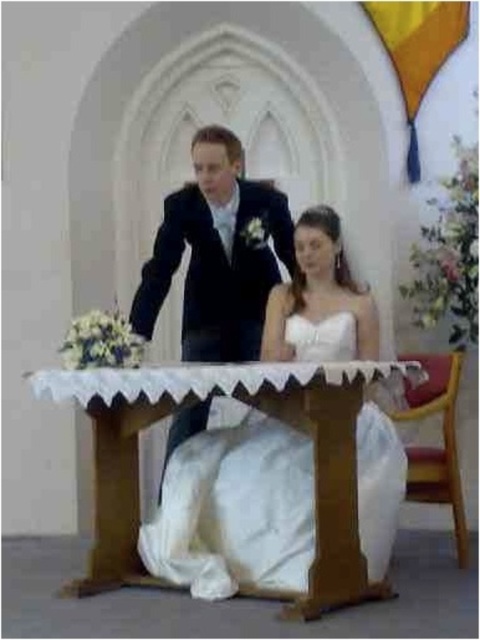
Describe the element at coordinates (255, 408) in the screenshot. I see `wooden table at center` at that location.

Who is lower down, wooden table at center or white satin wedding dress at center?

wooden table at center

The height and width of the screenshot is (640, 480). Find the location of `wooden table at center`. wooden table at center is located at coordinates pos(255,408).

From the picture: Can you confirm if wooden table at center is positioned above white satin dress at center?

No.

Does wooden table at center appear on the right side of white satin dress at center?

In fact, wooden table at center is to the left of white satin dress at center.

Find the location of a particular element. The height and width of the screenshot is (640, 480). wooden table at center is located at coordinates (255, 408).

Which is above, white satin dress at center or white satin wedding dress at center?

white satin dress at center

Identify the location of white satin dress at center. This screenshot has width=480, height=640. (319, 289).

Where is `white satin dress at center`? The width and height of the screenshot is (480, 640). white satin dress at center is located at coordinates (319, 289).